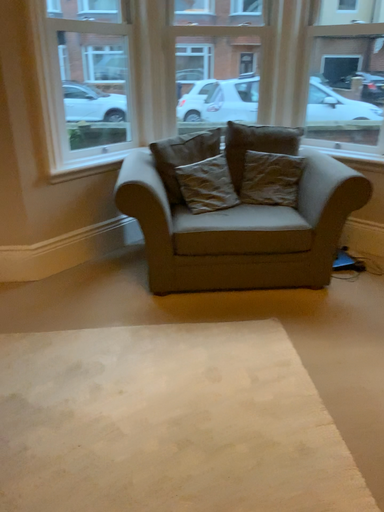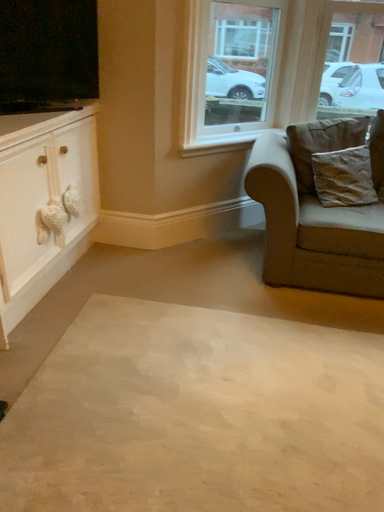
Question: Which way did the camera rotate in the video?

Choices:
 (A) rotated left
 (B) rotated right

Answer: (A)